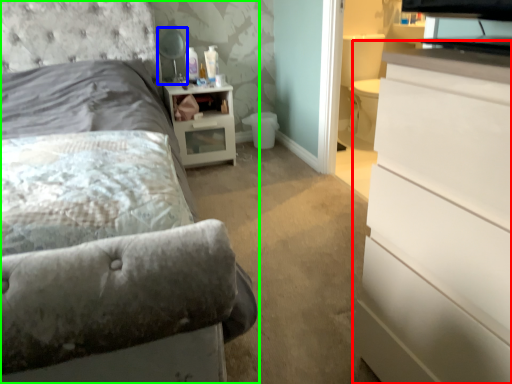
Question: Estimate the real-world distances between objects in this image. Which object is closer to chest of drawers (highlighted by a red box), table lamp (highlighted by a blue box) or bed (highlighted by a green box)?

Choices:
 (A) table lamp
 (B) bed

Answer: (B)